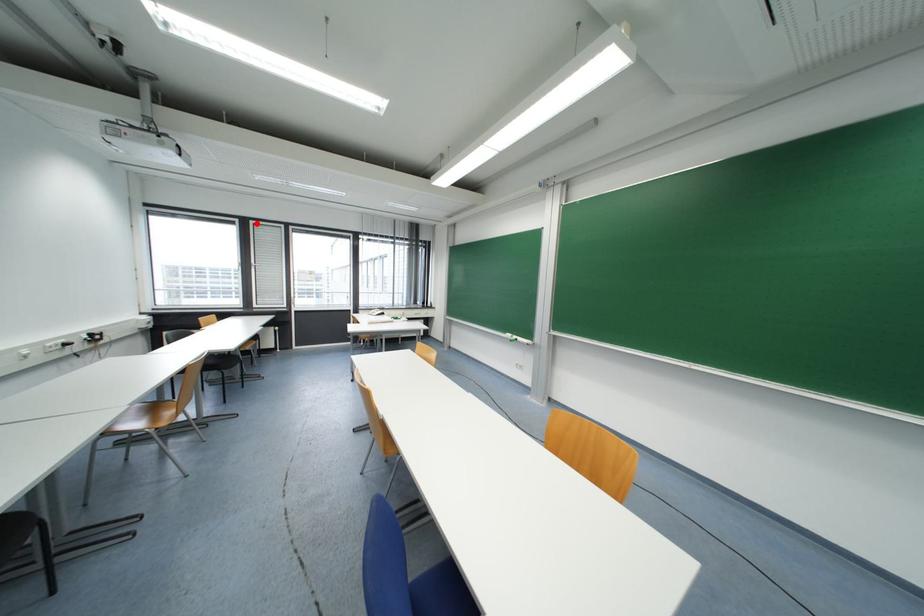
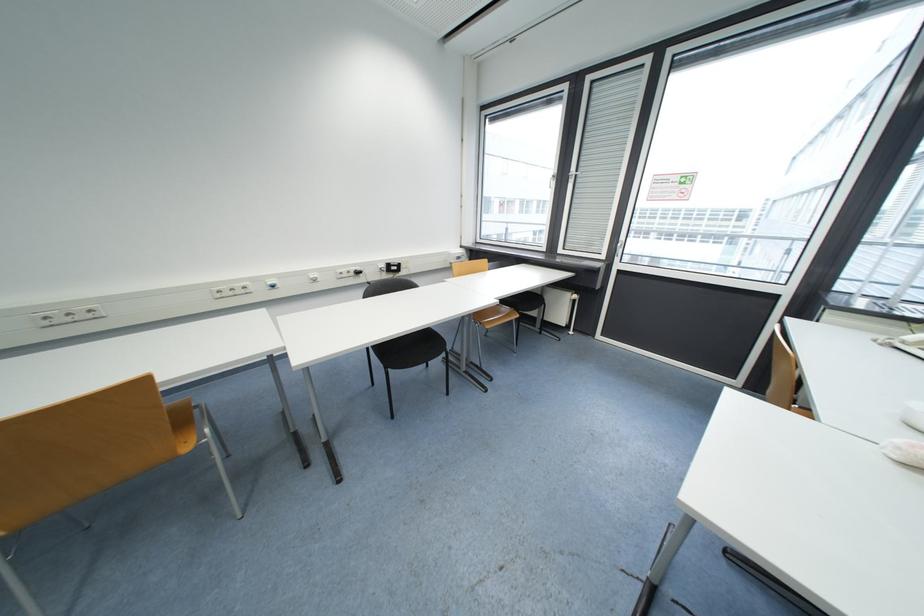
The point at the highlighted location is marked in the first image. Where is the corresponding point in the second image?

(593, 81)